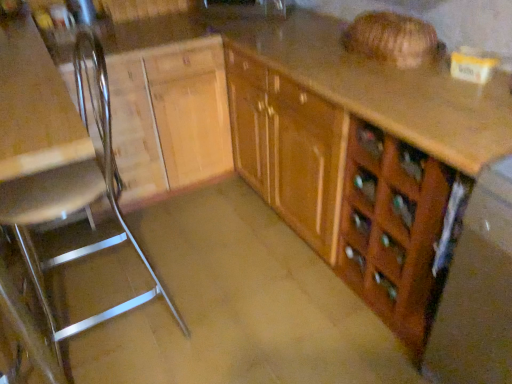
This screenshot has height=384, width=512. In order to click on vacant area that is situated to the right of metallic silver chair at left in this screenshot , I will do point(225,345).